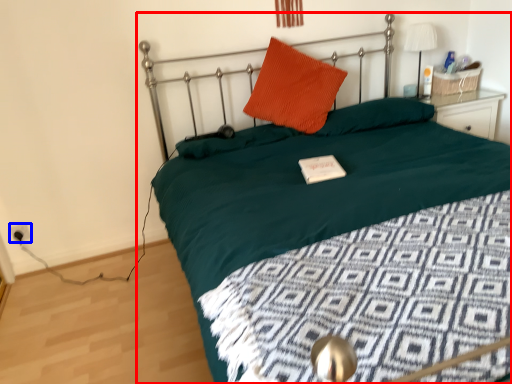
Question: Which object appears farthest to the camera in this image, bed (highlighted by a red box) or electric outlet (highlighted by a blue box)?

Choices:
 (A) bed
 (B) electric outlet

Answer: (B)